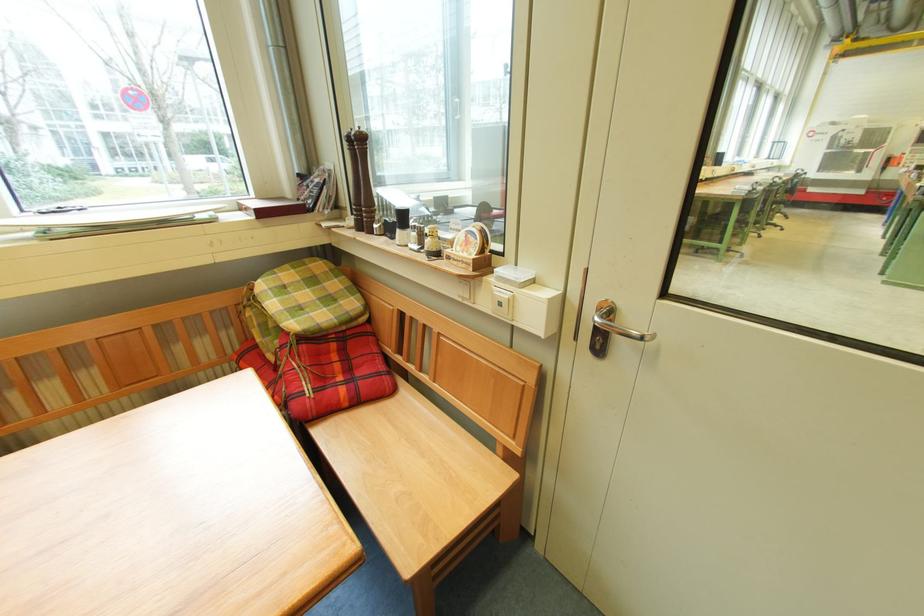
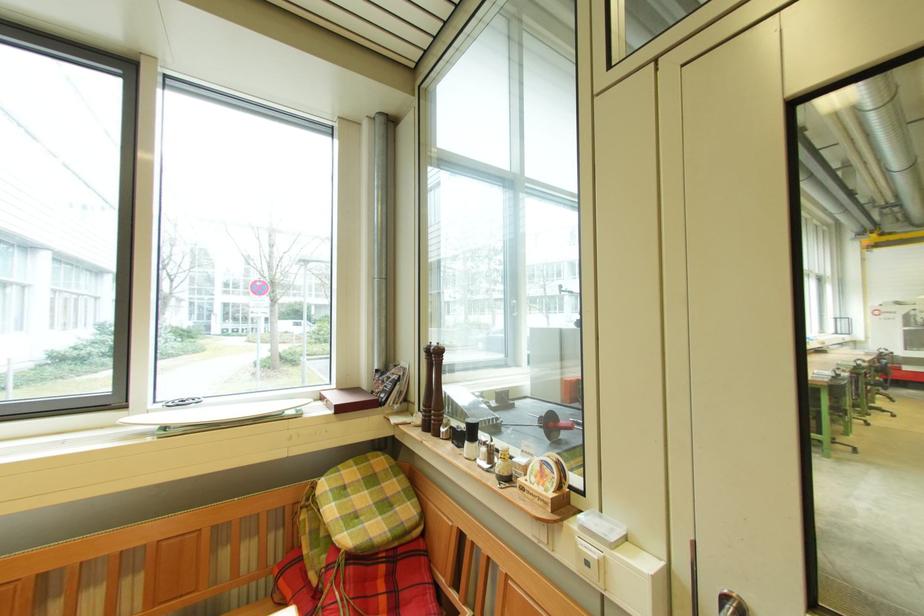
In a continuous first-person perspective shot, in which direction is the camera moving?

The cameraman moved toward left, backward.